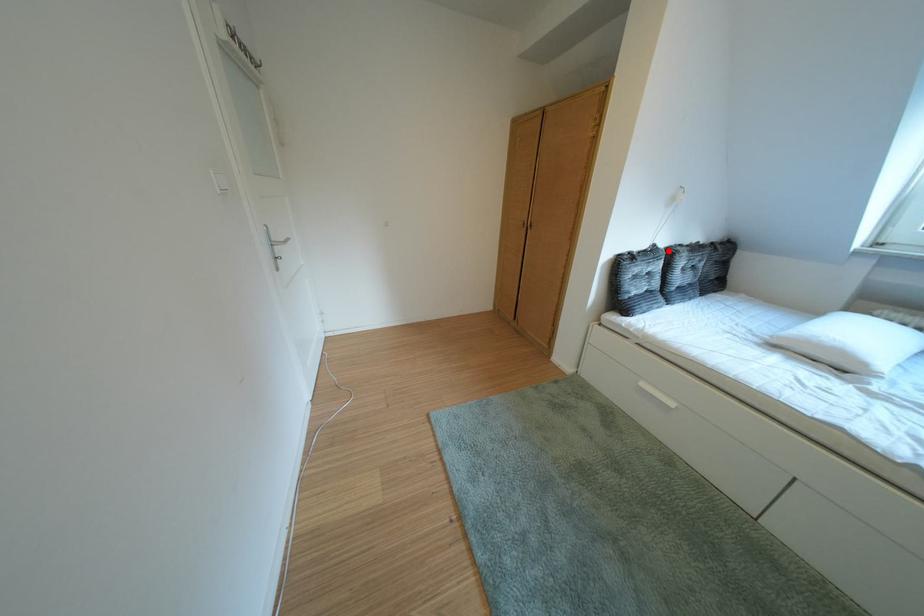
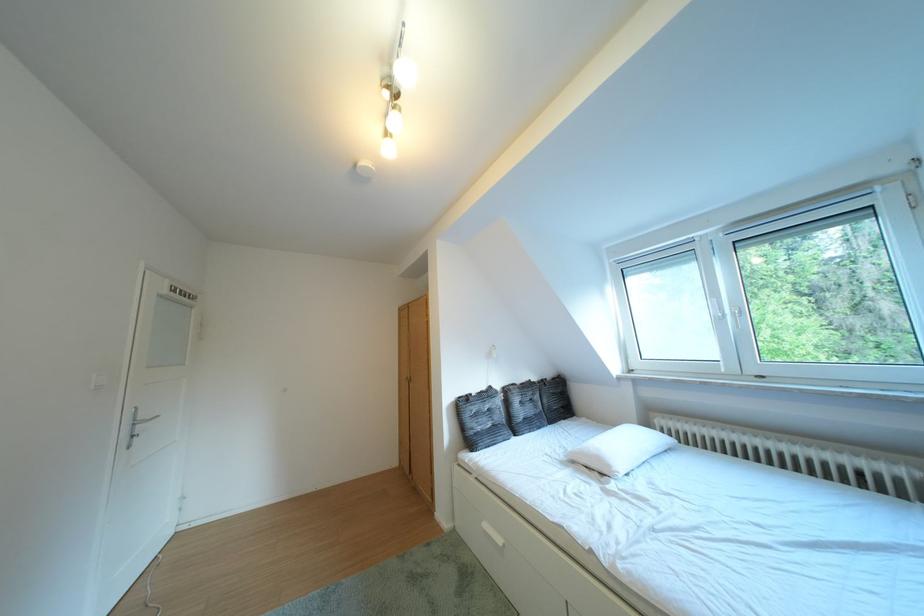
Question: I am providing you with two images of the same scene from different viewpoints. Given a red point in image1, look at the same physical point in image2. Is it:

Choices:
 (A) Closer to the viewpoint
 (B) Farther from the viewpoint

Answer: (B)